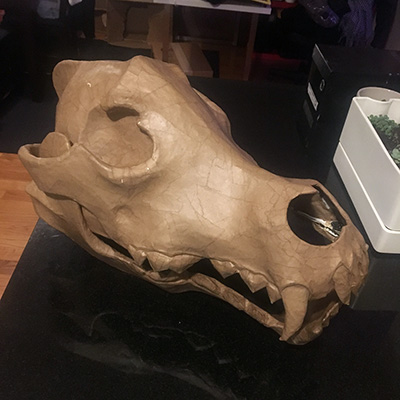
Identify the location of cutting board. The width and height of the screenshot is (400, 400). (191, 64).